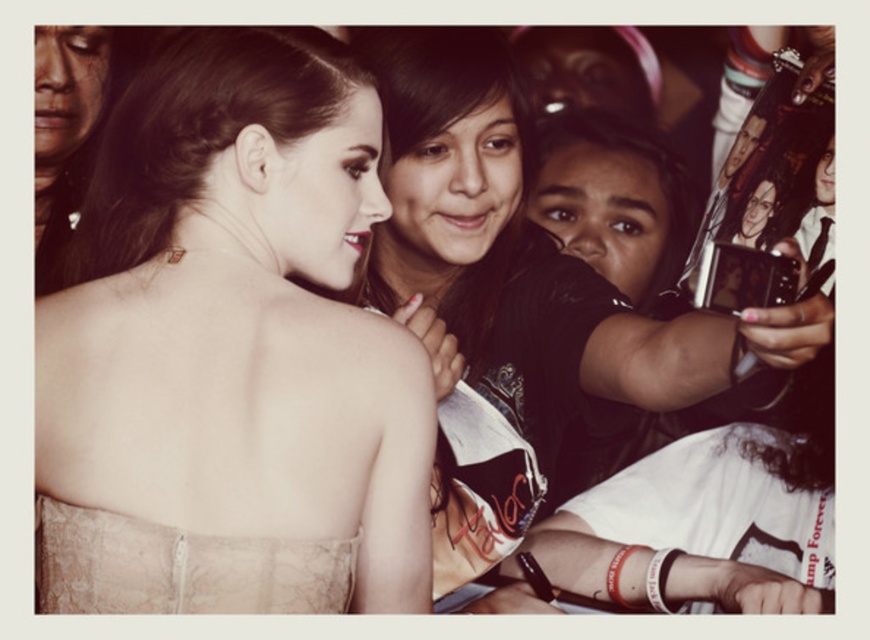
You are a photographer at the event and want to ensure the matte black dress at center is fully visible in your photo. Given that the matte black camera at right is currently blocking part of the dress, how should you adjust your position?

Move the matte black camera at right to the side so that the matte black dress at center is no longer obstructed.

You are at a fashion show and see two dresses displayed at the center of the runway. The first is a matte black dress at center, and the second is a lace fabric dress at center. According to the scene, which dress is more visible to the audience?

The matte black dress at center is positioned over the lace fabric dress at center, so the matte black dress at center is more visible to the audience.

You are a photographer at the event and want to capture both the matte black dress at center and the lace fabric dress at center in a single frame. Given that your camera has a minimum focus distance of 22 inches, will you be able to include both dresses in the shot without moving closer?

The matte black dress at center is 21.57 inches away from the lace fabric dress at center. Since this distance is less than the camera minimum focus distance of 22 inches, you won not be able to capture both dresses in the same frame without moving closer.